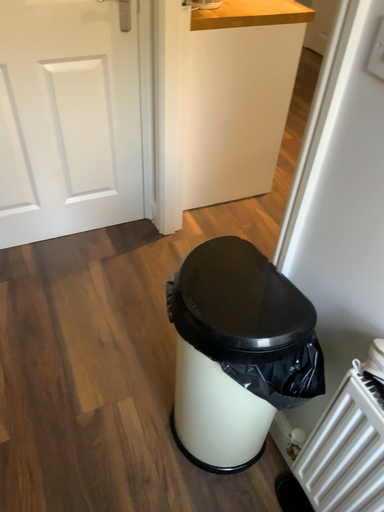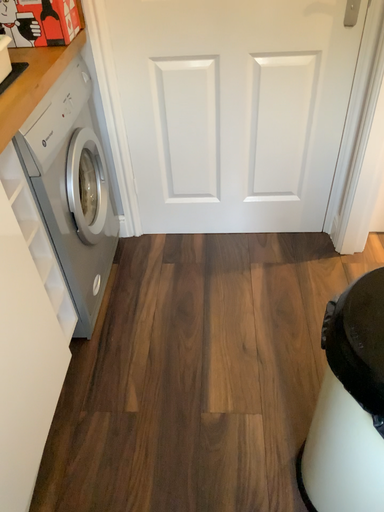
Question: Which way did the camera rotate in the video?

Choices:
 (A) rotated left
 (B) rotated right

Answer: (A)